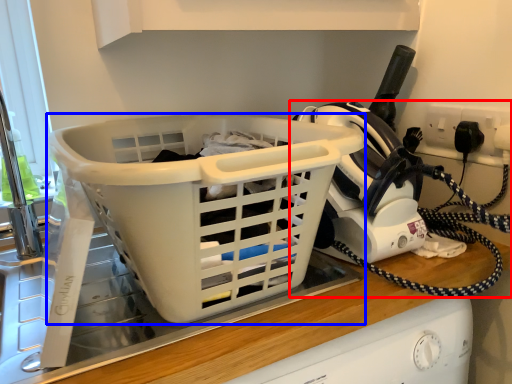
Question: Which of the following is the farthest to the observer, home appliance (highlighted by a red box) or basket (highlighted by a blue box)?

Choices:
 (A) home appliance
 (B) basket

Answer: (A)